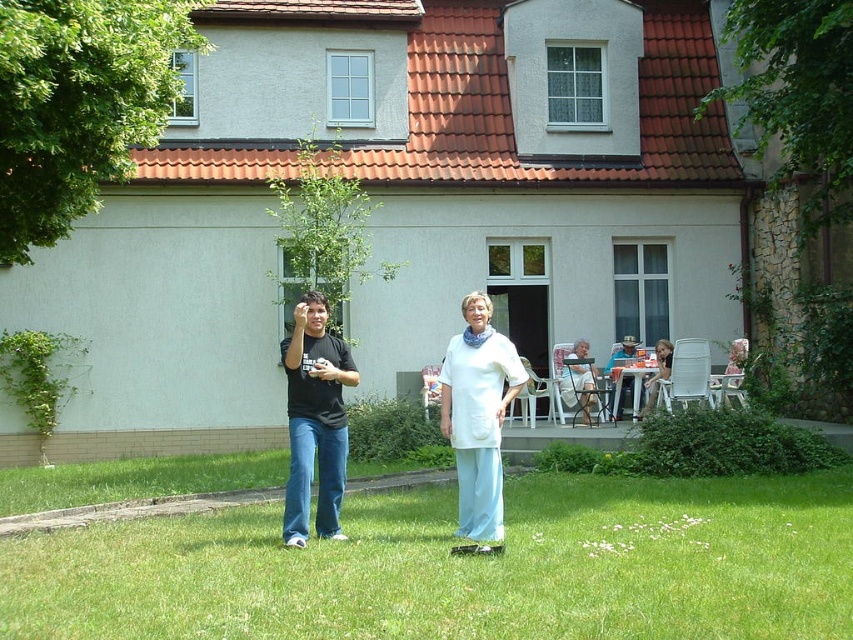
Question: Which object appears closest to the camera in this image?

Choices:
 (A) green grass at lower center
 (B) black matte shirt at center
 (C) white fabric chair at lower right
 (D) white cotton shirt at center

Answer: (A)

Question: Considering the relative positions of white cotton shirt at center and black matte shirt at center in the image provided, where is white cotton shirt at center located with respect to black matte shirt at center?

Choices:
 (A) below
 (B) above

Answer: (A)

Question: Which object is the farthest from the white fabric chair at lower right?

Choices:
 (A) matte white table at center
 (B) white cotton shirt at center

Answer: (B)

Question: Is green grass at lower center to the left of light brown wooden chair at lower right from the viewer's perspective?

Choices:
 (A) yes
 (B) no

Answer: (A)

Question: Among these objects, which one is nearest to the camera?

Choices:
 (A) white fabric chair at lower right
 (B) black matte shirt at center

Answer: (B)

Question: Considering the relative positions of white cotton shirt at center and matte white table at center in the image provided, where is white cotton shirt at center located with respect to matte white table at center?

Choices:
 (A) below
 (B) above

Answer: (A)